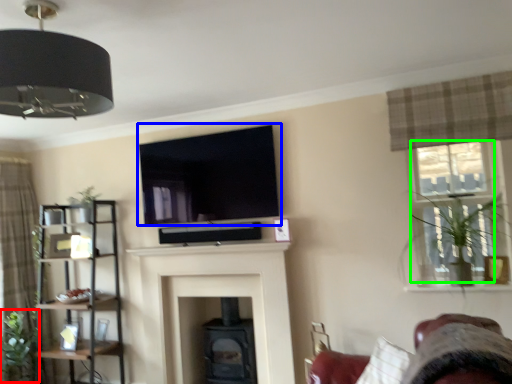
Question: Considering the real-world distances, which object is closest to plant (highlighted by a red box)? window screen (highlighted by a blue box) or window (highlighted by a green box).

Choices:
 (A) window screen
 (B) window

Answer: (A)